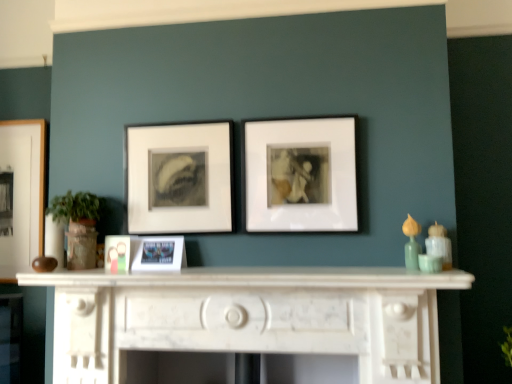
Question: From the image's perspective, is wooden picture frame at left, the 5th picture frame when ordered from right to left, on matte white frame at center, arranged as the second picture frame when viewed from the right?

Choices:
 (A) no
 (B) yes

Answer: (A)

Question: From a real-world perspective, is wooden picture frame at left, the 5th picture frame when ordered from right to left, on top of matte white frame at center, the 4th picture frame positioned from the front?

Choices:
 (A) no
 (B) yes

Answer: (A)

Question: Can you confirm if wooden picture frame at left, positioned as the 1th picture frame in back-to-front order, is bigger than matte white frame at center, the 4th picture frame when ordered from left to right?

Choices:
 (A) yes
 (B) no

Answer: (A)

Question: Considering the relative sizes of wooden picture frame at left, the fifth picture frame positioned from the front, and matte white frame at center, arranged as the second picture frame when viewed from the right, in the image provided, is wooden picture frame at left, the fifth picture frame positioned from the front, wider than matte white frame at center, arranged as the second picture frame when viewed from the right,?

Choices:
 (A) no
 (B) yes

Answer: (B)

Question: Does wooden picture frame at left, positioned as the 1th picture frame in back-to-front order, appear on the right side of matte white frame at center, arranged as the second picture frame when viewed from the right?

Choices:
 (A) yes
 (B) no

Answer: (B)

Question: Could matte white frame at center, the 4th picture frame positioned from the front, be considered to be inside wooden picture frame at left, the fifth picture frame positioned from the front?

Choices:
 (A) no
 (B) yes

Answer: (A)

Question: Can we say wooden picture frame at left, acting as the 1th picture frame starting from the left, lies outside white marble fireplace at center?

Choices:
 (A) no
 (B) yes

Answer: (B)

Question: Considering the relative sizes of wooden picture frame at left, acting as the 1th picture frame starting from the left, and white marble fireplace at center in the image provided, is wooden picture frame at left, acting as the 1th picture frame starting from the left, smaller than white marble fireplace at center?

Choices:
 (A) yes
 (B) no

Answer: (A)

Question: Does wooden picture frame at left, the fifth picture frame positioned from the front, have a lesser height compared to white marble fireplace at center?

Choices:
 (A) yes
 (B) no

Answer: (B)

Question: Considering the relative positions of wooden picture frame at left, the 5th picture frame when ordered from right to left, and white marble fireplace at center in the image provided, is wooden picture frame at left, the 5th picture frame when ordered from right to left, to the right of white marble fireplace at center from the viewer's perspective?

Choices:
 (A) yes
 (B) no

Answer: (B)

Question: Is wooden picture frame at left, positioned as the 1th picture frame in back-to-front order, closer to the viewer compared to white marble fireplace at center?

Choices:
 (A) yes
 (B) no

Answer: (B)

Question: From a real-world perspective, is wooden picture frame at left, acting as the 1th picture frame starting from the left, below white marble fireplace at center?

Choices:
 (A) yes
 (B) no

Answer: (B)

Question: Is white matte picture frame at center, the first picture frame in the front-to-back sequence, far from matte white frame at center, which is the second picture frame in back-to-front order?

Choices:
 (A) no
 (B) yes

Answer: (A)